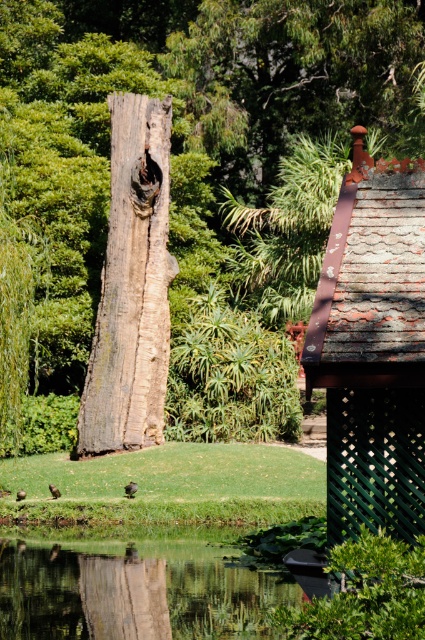
You are a gardener planning to place a new decorative stone on the weathered wood log at center. However, there is a concern about the stability of the log. Can you determine if the log is resting on top of or underneath the rusty metal roof at upper right?

The weathered wood log at center is positioned over the rusty metal roof at upper right, meaning it is resting on top of the roof. Therefore, placing the stone on the log should be stable as it is supported by the roof below.

You are a gardener trying to determine which object is taller between the weathered wood log at center and the weathered wood tree trunk at center. Based on the scene, which one is taller?

The weathered wood log at center is much taller than the weathered wood tree trunk at center according to the description.